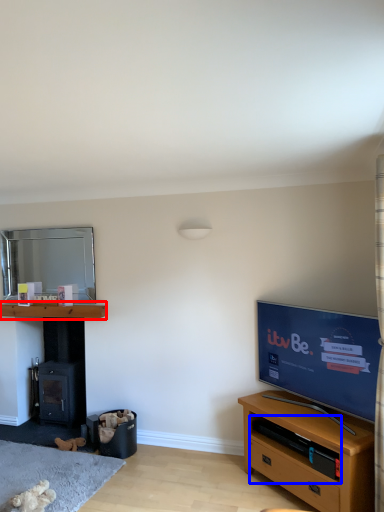
Question: Among these objects, which one is nearest to the camera, shelf (highlighted by a red box) or shelf (highlighted by a blue box)?

Choices:
 (A) shelf
 (B) shelf

Answer: (B)